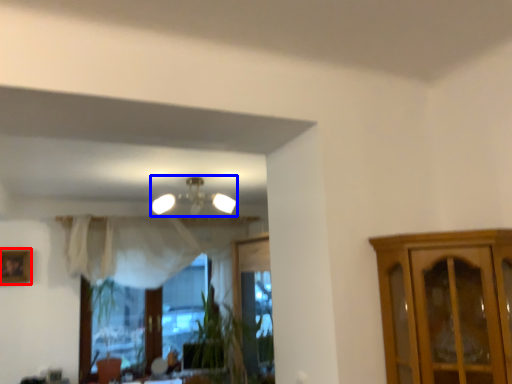
Question: Which object is closer to the camera taking this photo, picture frame (highlighted by a red box) or lamp (highlighted by a blue box)?

Choices:
 (A) picture frame
 (B) lamp

Answer: (B)